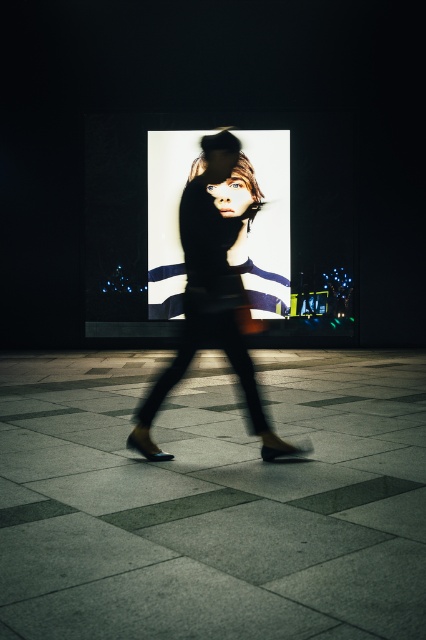
You are a photographer trying to capture a clear image of the silky black dress at center. The dress is placed at coordinates point 0.456, 0.500. Can you estimate where exactly the dress is located in the image frame?

The silky black dress at center is located at point (213, 291) in the image frame.

You are a photographer trying to capture the silky black dress at center in a photo. The dark gray concrete pavement at center is blocking part of the view. Can you move to the side to get a clear shot of the dress without the pavement in the way?

The dark gray concrete pavement at center is wider than the silky black dress at center, so moving to the side might not fully eliminate the pavement from the frame. Adjust your angle carefully to ensure the dress is visible while minimizing the pavement obstruction.

You are a photographer trying to capture a clear photo of the silky black dress at center without the dark gray concrete pavement at center blocking it. What adjustment should you make to your camera angle?

Since the dark gray concrete pavement at center is in front of the silky black dress at center, you should adjust your camera angle to look downward so that the pavement moves out of the frame, allowing the dress to be visible without obstruction.